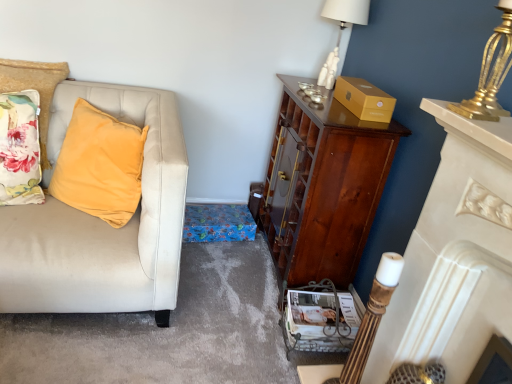
At what (x,y) coordinates should I click in order to perform the action: click on free region on the left part of matte white magazine at lower center. Please return your answer as a coordinate pair (x, y). Looking at the image, I should click on (258, 323).